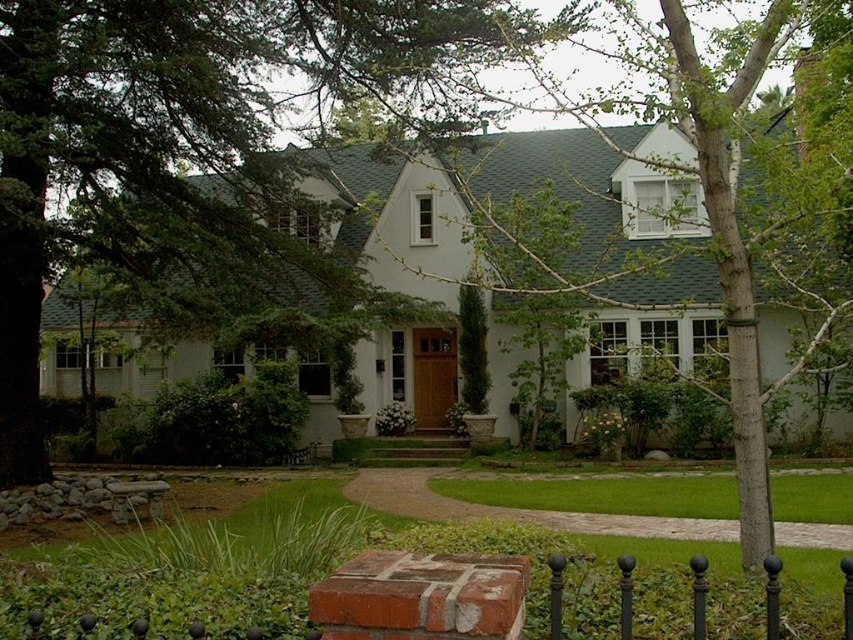
You are a gardener planning to plant a new tree in the front yard of the house. You have two options from the image, the green leafy tree at center and the smooth bark tree at center. Which tree would you choose if you want a taller tree for shade?

The smooth bark tree at center is taller than the green leafy tree at center, so it would be a better choice for providing shade.

You are a gardener who needs to trim the plants in the front yard of the house. You have a ladder that can reach up to 2 meters. The smooth bark tree at center and the green grass at center are in your way. Which one requires the ladder to be trimmed?

The smooth bark tree at center is taller than green grass at center, so the ladder will be needed to trim the smooth bark tree at center.